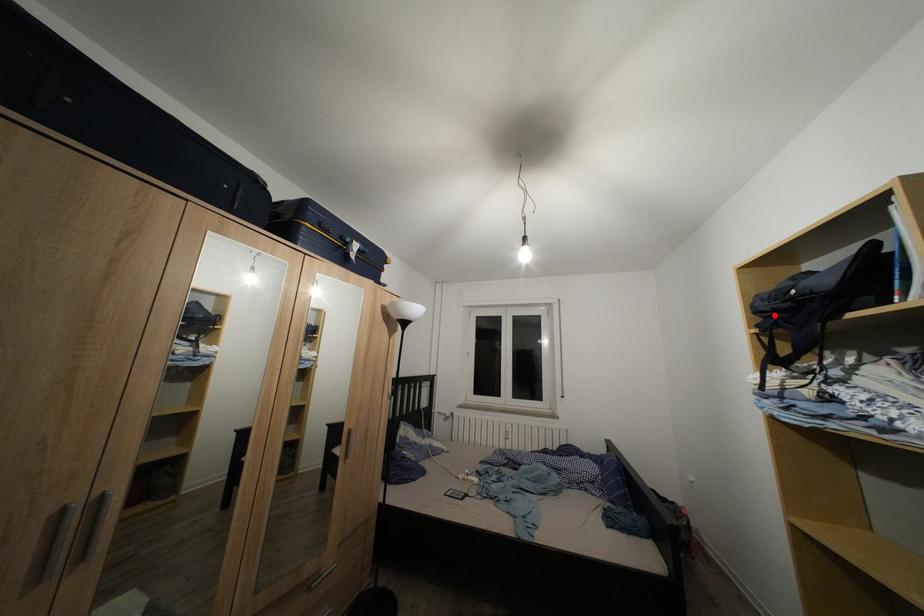
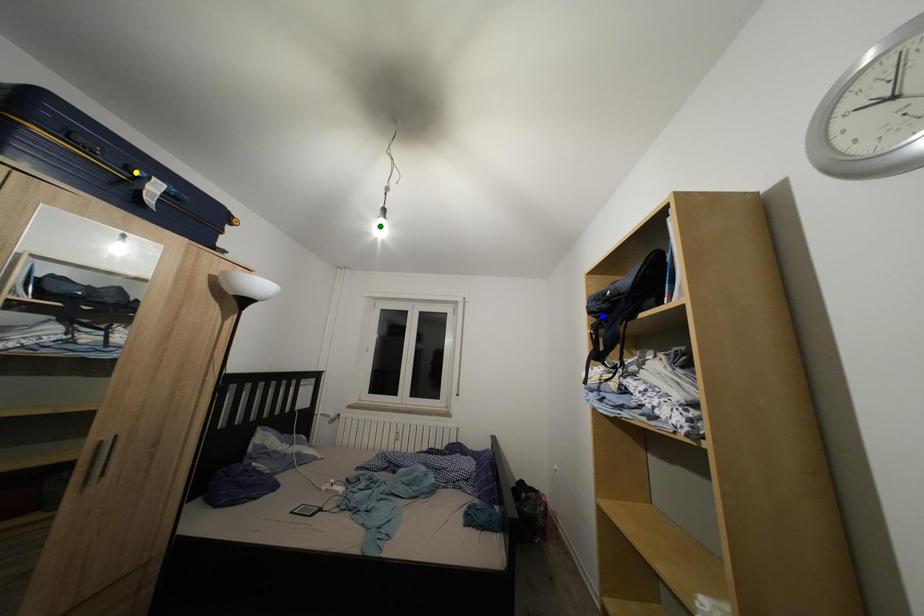
Question: I am providing you with two images of the same scene from different viewpoints. A red point is marked on the first image. You are given multiple points on the second image. Which point in image 2 is actually the same real-world point as the red point in image 1?

Choices:
 (A) blue point
 (B) green point
 (C) yellow point

Answer: (A)